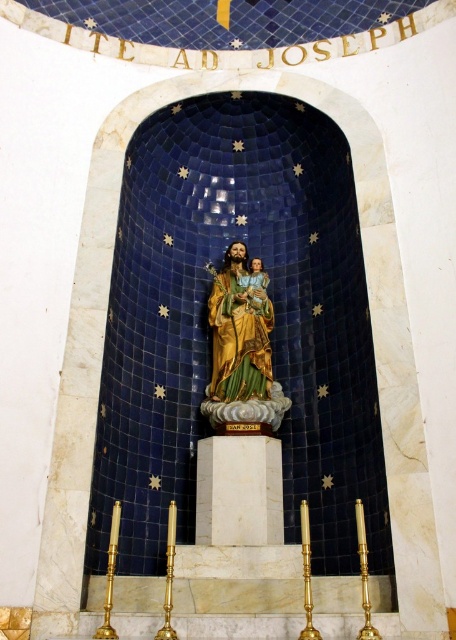
You are standing in the church and want to place a small candle between the two points labeled point (223, 330) and point (263, 273). Which point should the candle be closer to in order to be placed in front of the other point?

The candle should be closer to point (223, 330) because it is in front of point (263, 273).